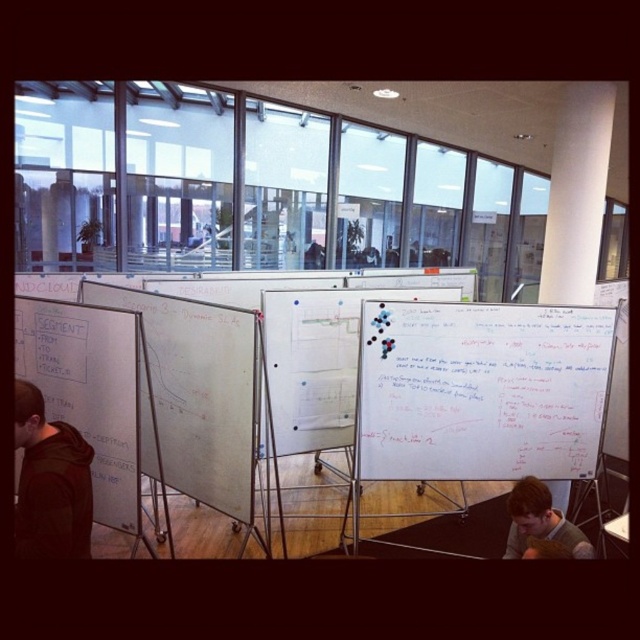
Question: Based on their relative distances, which object is nearer to the white matte whiteboard at left?

Choices:
 (A) whiteboard at left
 (B) dark brown hoodie at lower left
 (C) whiteboard at center
 (D) gray sweater at lower right

Answer: (B)

Question: Which of the following is the closest to the observer?

Choices:
 (A) (157, 356)
 (B) (518, 538)
 (C) (19, 509)

Answer: (C)

Question: Does white matte whiteboard at left come in front of white smooth pillar at upper center?

Choices:
 (A) yes
 (B) no

Answer: (A)

Question: Is whiteboard at center thinner than whiteboard at left?

Choices:
 (A) yes
 (B) no

Answer: (B)

Question: Which of these objects is positioned closest to the whiteboard at left?

Choices:
 (A) white smooth pillar at upper center
 (B) whiteboard at center
 (C) dark brown hoodie at lower left

Answer: (C)

Question: Is whiteboard at center positioned before white matte whiteboard at left?

Choices:
 (A) yes
 (B) no

Answer: (B)